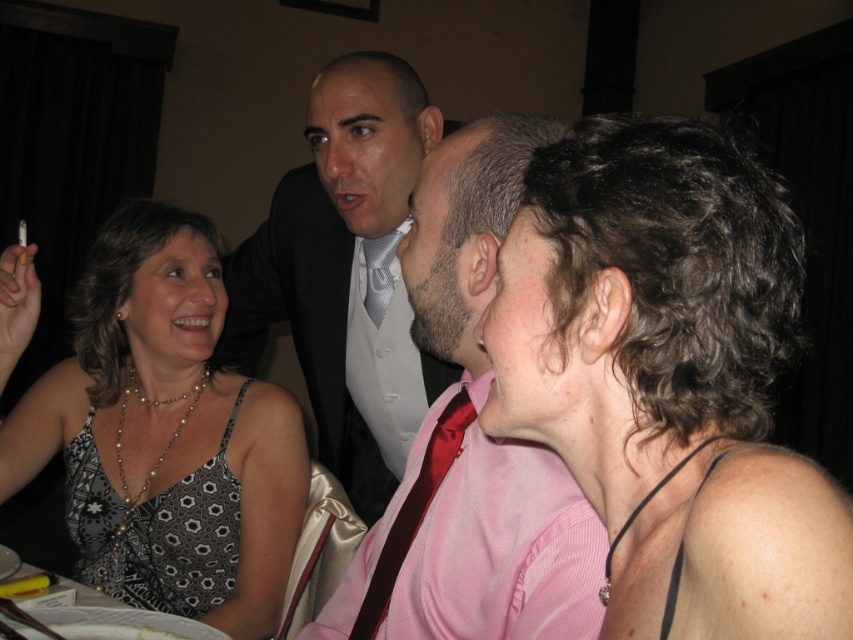
Consider the image. You are standing in the same room as the three seated people. There are two points marked in the image. One is at coordinate point (369, 150) and the other is at (383, 349). Which point is closer to you?

Point (369, 150) is closer to you than point (383, 349).

From the picture: You are a photographer at a social event and need to capture a closeup of the shiny black suit at center and the white textured dress shirt at center. The camera you are using has a minimum focusing distance of 10 centimeters. Can you take the photo without moving the subjects?

The shiny black suit at center is 9.91 centimeters from the white textured dress shirt at center, which is less than the camera minimum focusing distance of 10 centimeters. Therefore, you cannot take the photo without moving the subjects.